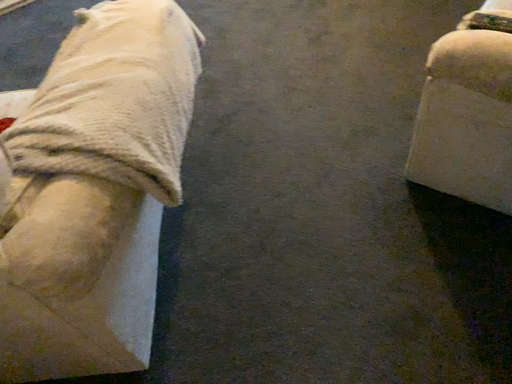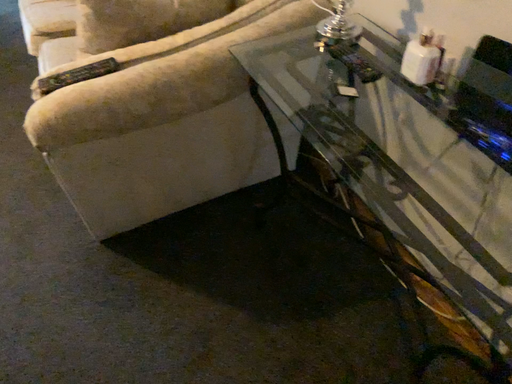
Question: How did the camera likely rotate when shooting the video?

Choices:
 (A) rotated upward
 (B) rotated downward

Answer: (A)